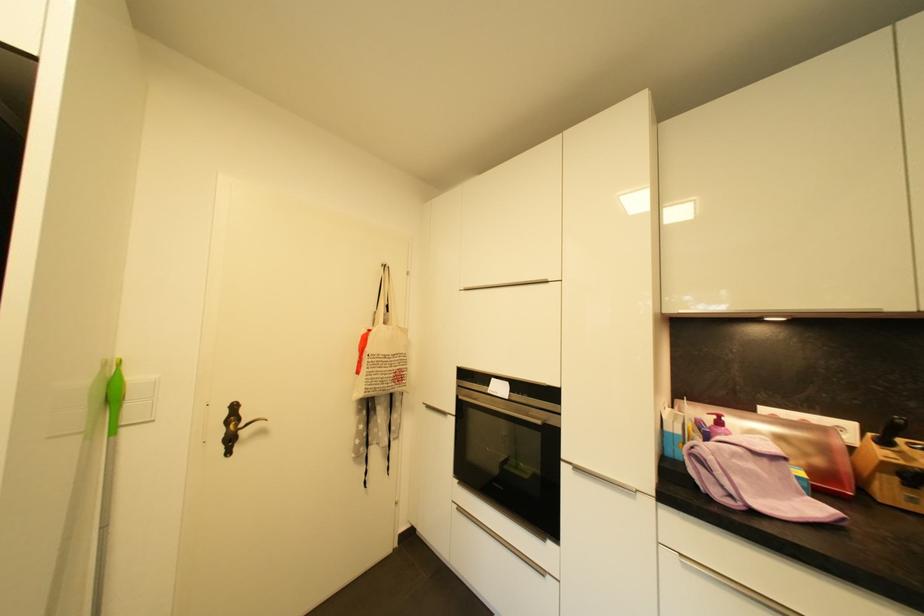
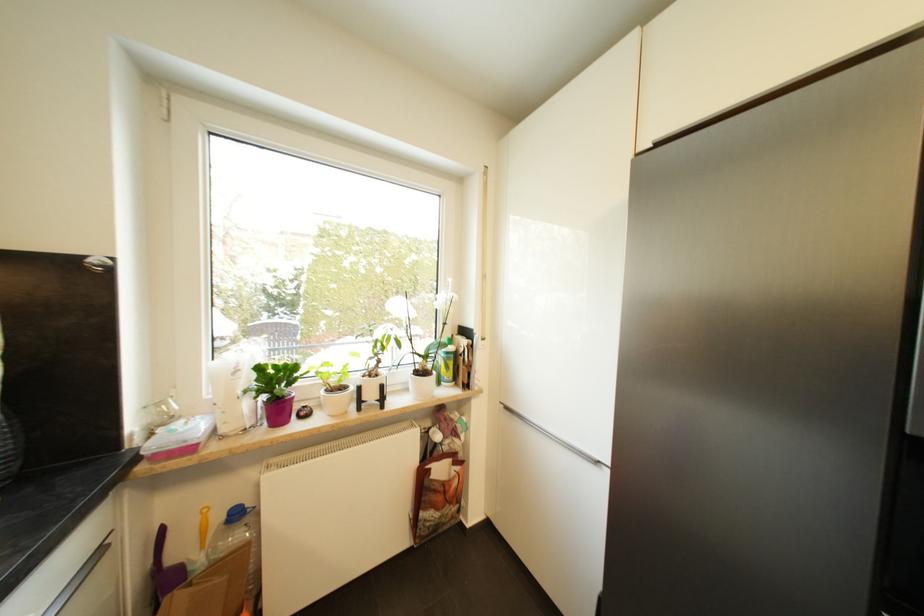
Question: Based on the continuous images, in which direction is the camera rotating? Reply with the corresponding letter.

Choices:
 (A) Left
 (B) Right
 (C) Up
 (D) Down

Answer: (A)